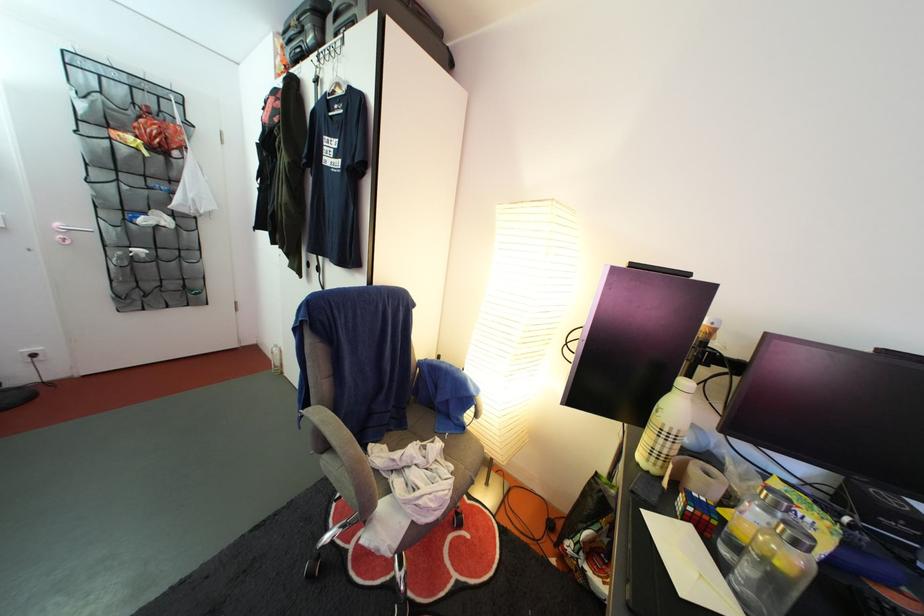
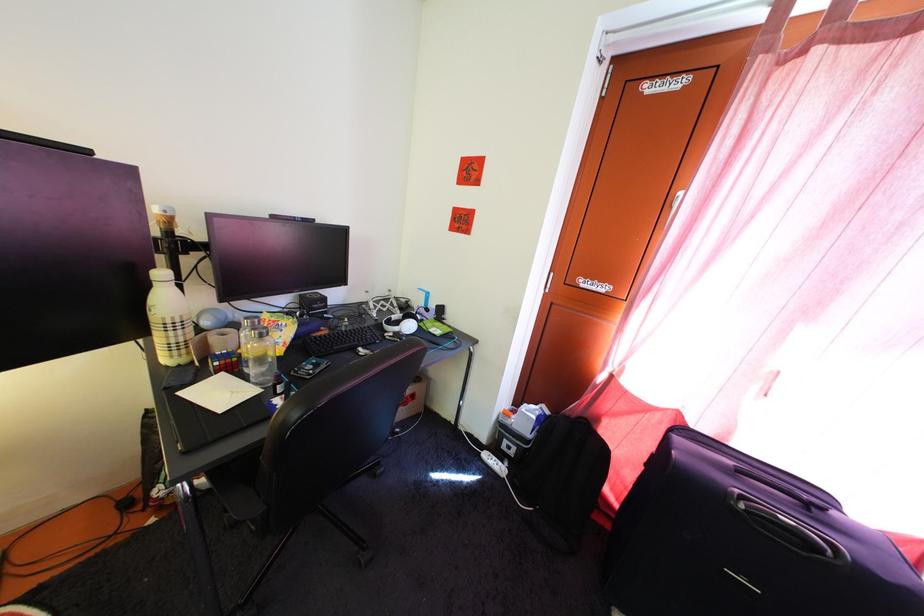
Locate, in the second image, the point that corresponds to point 795,532 in the first image.

(262, 338)